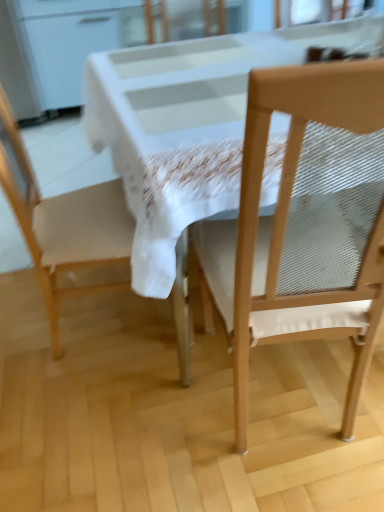
Image resolution: width=384 pixels, height=512 pixels. In order to click on white glossy table at center in this screenshot , I will do `click(187, 127)`.

The width and height of the screenshot is (384, 512). What do you see at coordinates (62, 222) in the screenshot?
I see `matte white chair at left, positioned as the first chair in left-to-right order` at bounding box center [62, 222].

In order to click on wooden chair at right, marked as the second chair in a left-to-right arrangement in this screenshot , I will do `click(305, 224)`.

Find the location of `white glossy table at center`. white glossy table at center is located at coordinates (187, 127).

How much distance is there between wooden chair at right, marked as the second chair in a left-to-right arrangement, and white glossy table at center?

They are 13.52 inches apart.

You are a GUI agent. You are given a task and a screenshot of the screen. Output one action in this format:
    pyautogui.click(x=<x>, y=<y>)
    Task: Click on the 2nd chair positioned below the white glossy table at center (from the image's perspective)
    
    Given the screenshot: What is the action you would take?
    pyautogui.click(x=305, y=224)

Considering the positions of point (342, 272) and point (115, 94), is point (342, 272) closer or farther from the camera than point (115, 94)?

Point (342, 272).

Is there a large distance between wooden chair at right, marked as the second chair in a left-to-right arrangement, and white glossy table at center?

No, wooden chair at right, marked as the second chair in a left-to-right arrangement, is not far away from white glossy table at center.

From a real-world perspective, between matte white chair at left, which appears as the 2th chair when viewed from the right, and white glossy table at center, who is vertically higher?

From a 3D spatial view, matte white chair at left, which appears as the 2th chair when viewed from the right, is above.

Which point is more forward, (24, 189) or (222, 123)?

Positioned in front is point (222, 123).

Based on the photo, which is correct: matte white chair at left, positioned as the first chair in left-to-right order, is inside white glossy table at center, or outside of it?

matte white chair at left, positioned as the first chair in left-to-right order, is inside white glossy table at center.

Who is taller, matte white chair at left, positioned as the first chair in left-to-right order, or white glossy table at center?

matte white chair at left, positioned as the first chair in left-to-right order, is taller.

Does matte white chair at left, positioned as the first chair in left-to-right order, have a greater width compared to wooden chair at right, acting as the 1th chair starting from the right?

No.

Is matte white chair at left, positioned as the first chair in left-to-right order, aimed at wooden chair at right, acting as the 1th chair starting from the right?

No, matte white chair at left, positioned as the first chair in left-to-right order, is not oriented towards wooden chair at right, acting as the 1th chair starting from the right.

Who is bigger, matte white chair at left, which appears as the 2th chair when viewed from the right, or wooden chair at right, marked as the second chair in a left-to-right arrangement?

With larger size is wooden chair at right, marked as the second chair in a left-to-right arrangement.

From the image's perspective, is matte white chair at left, which appears as the 2th chair when viewed from the right, located above or below wooden chair at right, acting as the 1th chair starting from the right?

matte white chair at left, which appears as the 2th chair when viewed from the right, is situated higher than wooden chair at right, acting as the 1th chair starting from the right, in the image.

How many degrees apart are the facing directions of white glossy table at center and matte white chair at left, which appears as the 2th chair when viewed from the right?

176 degrees separate the facing orientations of white glossy table at center and matte white chair at left, which appears as the 2th chair when viewed from the right.

The width and height of the screenshot is (384, 512). I want to click on round table below the matte white chair at left, positioned as the first chair in left-to-right order (from a real-world perspective), so click(187, 127).

Measure the distance from white glossy table at center to matte white chair at left, which appears as the 2th chair when viewed from the right.

A distance of 13.90 inches exists between white glossy table at center and matte white chair at left, which appears as the 2th chair when viewed from the right.

Is point (236, 97) farther from camera compared to point (31, 232)?

No, it is not.

Measure the distance between wooden chair at right, acting as the 1th chair starting from the right, and matte white chair at left, which appears as the 2th chair when viewed from the right.

The distance of wooden chair at right, acting as the 1th chair starting from the right, from matte white chair at left, which appears as the 2th chair when viewed from the right, is 14.91 inches.

Consider the image. Does wooden chair at right, acting as the 1th chair starting from the right, have a lesser width compared to matte white chair at left, positioned as the first chair in left-to-right order?

No.

From the image's perspective, which one is positioned higher, wooden chair at right, marked as the second chair in a left-to-right arrangement, or matte white chair at left, which appears as the 2th chair when viewed from the right?

From the image's view, matte white chair at left, which appears as the 2th chair when viewed from the right, is above.

Which is more to the right, wooden chair at right, acting as the 1th chair starting from the right, or matte white chair at left, which appears as the 2th chair when viewed from the right?

wooden chair at right, acting as the 1th chair starting from the right, is more to the right.

Is white glossy table at center situated inside wooden chair at right, marked as the second chair in a left-to-right arrangement, or outside?

The correct answer is: outside.

Locate an element on the screen. The height and width of the screenshot is (512, 384). the 1st chair to the left of the white glossy table at center, counting from the anchor's position is located at coordinates (305, 224).

Is white glossy table at center shorter than wooden chair at right, marked as the second chair in a left-to-right arrangement?

Yes, white glossy table at center is shorter than wooden chair at right, marked as the second chair in a left-to-right arrangement.

Considering the positions of points (108, 123) and (347, 197), is point (108, 123) closer to camera compared to point (347, 197)?

No, it is behind (347, 197).

Where is `chair that is the 1st object to the left of the white glossy table at center, starting at the anchor`? The height and width of the screenshot is (512, 384). chair that is the 1st object to the left of the white glossy table at center, starting at the anchor is located at coordinates (305, 224).

This screenshot has width=384, height=512. Find the location of `round table that is on the right side of matte white chair at left, positioned as the first chair in left-to-right order`. round table that is on the right side of matte white chair at left, positioned as the first chair in left-to-right order is located at coordinates (187, 127).

Estimate the real-world distances between objects in this image. Which object is closer to white glossy table at center, matte white chair at left, which appears as the 2th chair when viewed from the right, or wooden chair at right, marked as the second chair in a left-to-right arrangement?

wooden chair at right, marked as the second chair in a left-to-right arrangement.

Considering their positions, is wooden chair at right, acting as the 1th chair starting from the right, positioned further to matte white chair at left, positioned as the first chair in left-to-right order, than white glossy table at center?

The object further to matte white chair at left, positioned as the first chair in left-to-right order, is wooden chair at right, acting as the 1th chair starting from the right.

Considering their positions, is wooden chair at right, marked as the second chair in a left-to-right arrangement, positioned closer to white glossy table at center than matte white chair at left, positioned as the first chair in left-to-right order?

The object closer to white glossy table at center is wooden chair at right, marked as the second chair in a left-to-right arrangement.

Looking at this image, when comparing their distances from wooden chair at right, acting as the 1th chair starting from the right, does matte white chair at left, positioned as the first chair in left-to-right order, or white glossy table at center seem closer?

white glossy table at center is positioned closer to the anchor wooden chair at right, acting as the 1th chair starting from the right.

When comparing their distances from wooden chair at right, marked as the second chair in a left-to-right arrangement, does white glossy table at center or matte white chair at left, positioned as the first chair in left-to-right order, seem further?

Based on the image, matte white chair at left, positioned as the first chair in left-to-right order, appears to be further to wooden chair at right, marked as the second chair in a left-to-right arrangement.

When comparing their distances from matte white chair at left, positioned as the first chair in left-to-right order, does white glossy table at center or wooden chair at right, acting as the 1th chair starting from the right, seem further?

wooden chair at right, acting as the 1th chair starting from the right.

You are a GUI agent. You are given a task and a screenshot of the screen. Output one action in this format:
    pyautogui.click(x=<x>, y=<y>)
    Task: Click on the chair between matte white chair at left, which appears as the 2th chair when viewed from the right, and white glossy table at center, in the horizontal direction
    
    Given the screenshot: What is the action you would take?
    pyautogui.click(x=305, y=224)